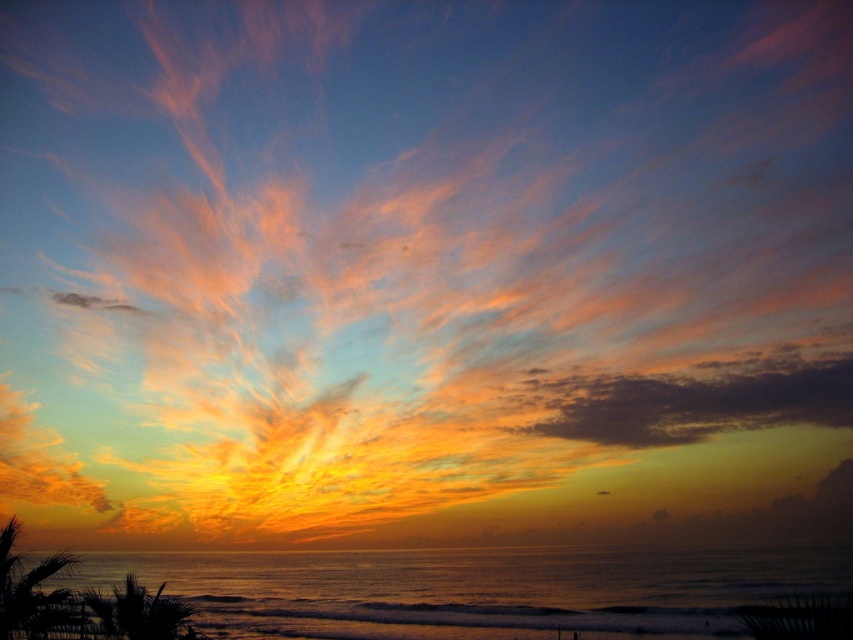
You are observing the sunset scene and want to determine the relative positions of two points in the image. Which of the two points, point (689, 596) or point (618, 420), is closer to your viewpoint as the observer?

Point (689, 596) is closer to the camera than point (618, 420), so it is closer to your viewpoint as the observer.